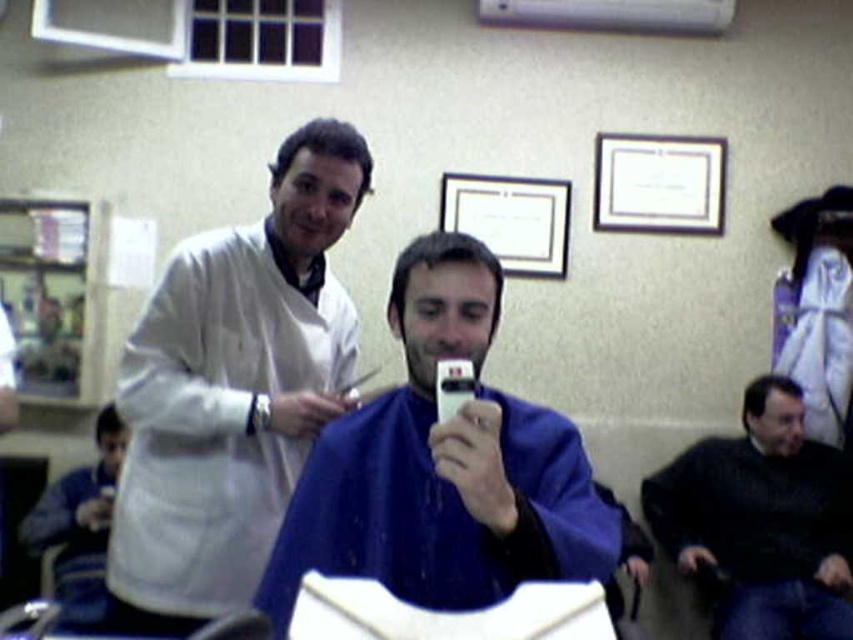
Who is shorter, white matte lab coat at upper left or blue fabric at lower left?

Standing shorter between the two is blue fabric at lower left.

Which is in front, point (338, 346) or point (86, 525)?

Point (338, 346) is in front.

Identify the location of white matte lab coat at upper left. (218, 420).

Is white matte lab coat at upper left behind black matte jacket at lower right?

That is False.

Which is below, white matte lab coat at upper left or black matte jacket at lower right?

black matte jacket at lower right is lower down.

Is point (138, 595) more distant than point (817, 508)?

No, (138, 595) is in front of (817, 508).

In order to click on white matte lab coat at upper left in this screenshot , I will do `click(218, 420)`.

Measure the distance between black matte jacket at lower right and smooth dark hair at center.

A distance of 1.98 meters exists between black matte jacket at lower right and smooth dark hair at center.

Is the position of black matte jacket at lower right more distant than that of smooth dark hair at center?

Yes, it is behind smooth dark hair at center.

The width and height of the screenshot is (853, 640). Find the location of `black matte jacket at lower right`. black matte jacket at lower right is located at coordinates (762, 520).